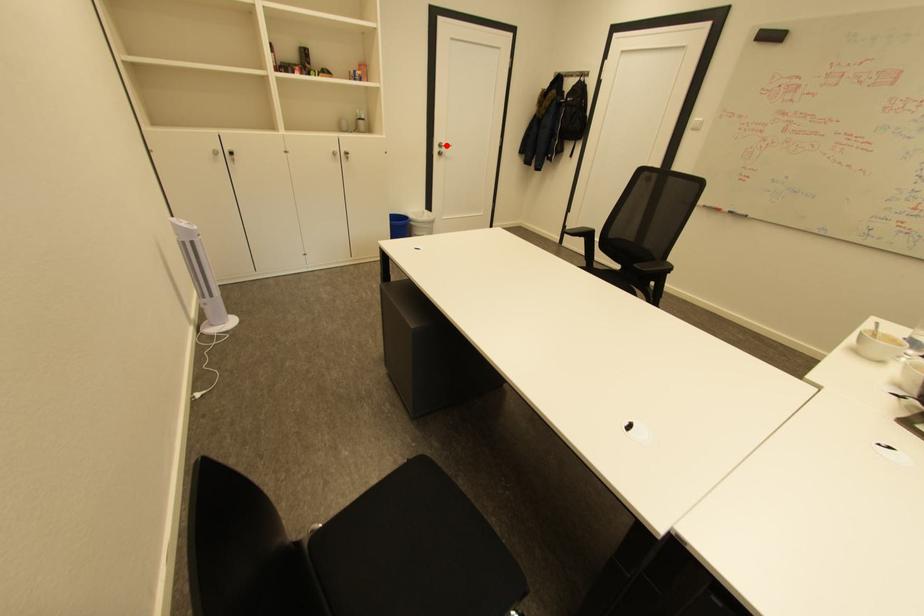
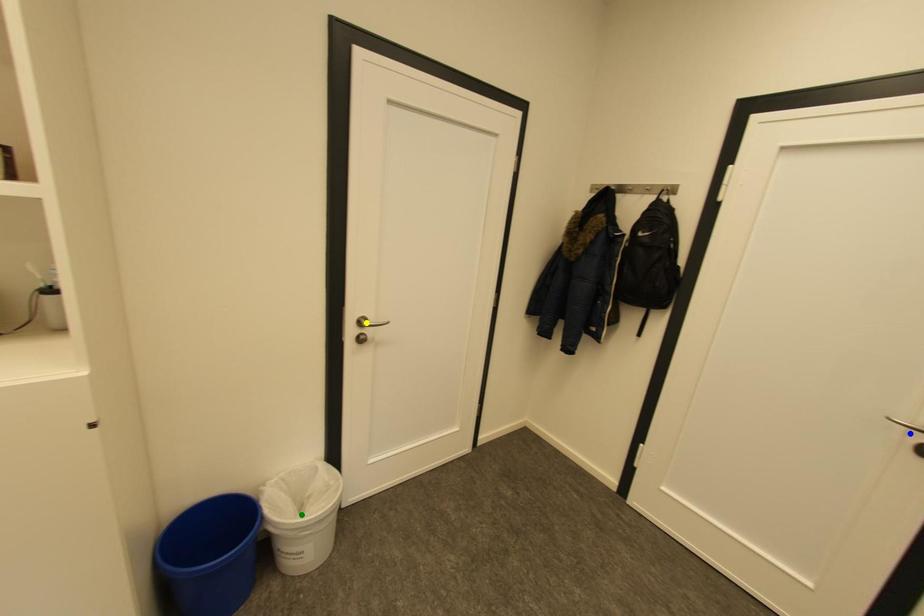
Question: I am providing you with two images of the same scene from different viewpoints. A red point is marked on the first image. You are given multiple points on the second image. Which spot in image 2 lines up with the point in image 1?

Choices:
 (A) yellow point
 (B) blue point
 (C) green point

Answer: (A)